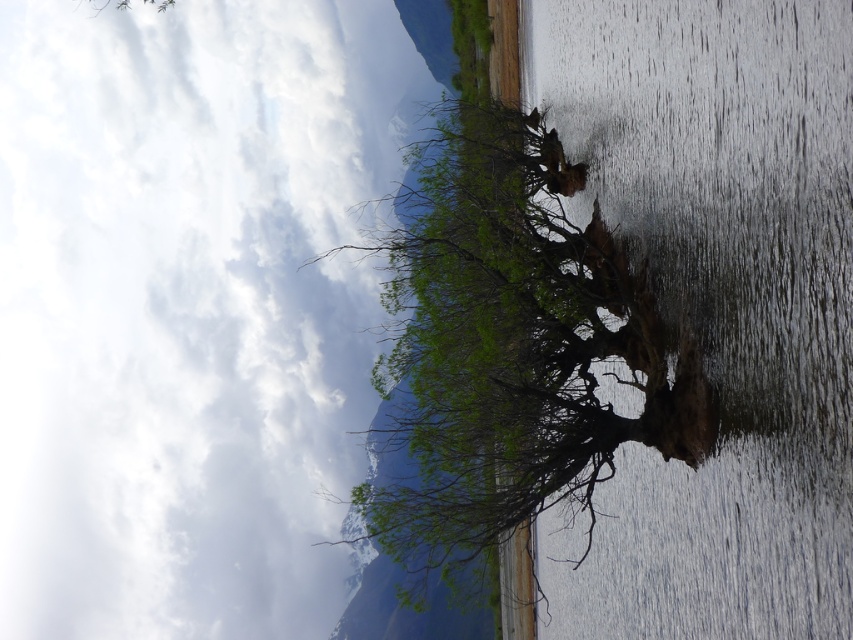
You are standing in the middle of the scene and see the green leafy tree at upper center and the green leafy tree at center. Which tree is positioned higher in the image?

The green leafy tree at upper center is positioned higher in the image than the green leafy tree at center.

You are observing the scene and need to determine which object is taller. Based on the information provided, which one is shorter between the brown rough tree trunk at center and the green leafy tree at center?

The brown rough tree trunk at center is shorter than the green leafy tree at center.